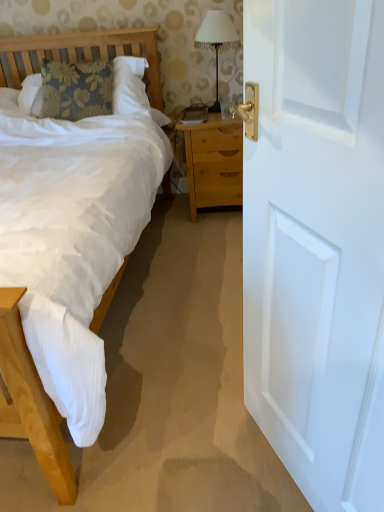
This screenshot has height=512, width=384. Describe the element at coordinates (216, 40) in the screenshot. I see `white fabric lampshade at upper center` at that location.

The height and width of the screenshot is (512, 384). In order to click on light brown wooden nightstand at center in this screenshot , I will do `click(213, 162)`.

Could you tell me if light brown wooden nightstand at center is facing white painted wood door at right?

Yes.

At what (x,y) coordinates should I click in order to perform the action: click on door above the light brown wooden nightstand at center (from a real-world perspective). Please return your answer as a coordinate pair (x, y). Looking at the image, I should click on (317, 244).

Does light brown wooden nightstand at center have a larger size compared to white painted wood door at right?

Correct, light brown wooden nightstand at center is larger in size than white painted wood door at right.

Are light brown wooden nightstand at center and white painted wood door at right located far from each other?

Absolutely, light brown wooden nightstand at center is distant from white painted wood door at right.

Who is smaller, white painted wood door at right or light brown wooden nightstand at center?

white painted wood door at right is smaller.

Looking at their sizes, would you say white painted wood door at right is wider or thinner than light brown wooden nightstand at center?

Clearly, white painted wood door at right has less width compared to light brown wooden nightstand at center.

Is white painted wood door at right to the left of light brown wooden nightstand at center from the viewer's perspective?

No.

Does white painted wood door at right have a greater height compared to light brown wooden nightstand at center?

Yes.

Considering the positions of points (209, 16) and (233, 132), is point (209, 16) farther from camera compared to point (233, 132)?

Yes, it is.

Is white fabric lampshade at upper center far away from light brown wooden nightstand at center?

That's not correct — white fabric lampshade at upper center is a little close to light brown wooden nightstand at center.

Is light brown wooden nightstand at center located within white fabric lampshade at upper center?

No, white fabric lampshade at upper center does not contain light brown wooden nightstand at center.

Can you confirm if white fabric lampshade at upper center is positioned to the left of light brown wooden nightstand at center?

In fact, white fabric lampshade at upper center is to the right of light brown wooden nightstand at center.

Which is behind, point (213, 20) or point (303, 200)?

The point (213, 20) is behind.

Based on their sizes in the image, would you say white fabric lampshade at upper center is bigger or smaller than white painted wood door at right?

white fabric lampshade at upper center is smaller than white painted wood door at right.

Does white fabric lampshade at upper center appear on the left side of white painted wood door at right?

Indeed, white fabric lampshade at upper center is positioned on the left side of white painted wood door at right.

Measure the distance between white fabric lampshade at upper center and white painted wood door at right.

The distance of white fabric lampshade at upper center from white painted wood door at right is 2.04 meters.

Is white painted wood door at right oriented away from white fabric lampshade at upper center?

No, white painted wood door at right is not facing the opposite direction of white fabric lampshade at upper center.

Which is closer, (332, 408) or (202, 32)?

Point (332, 408) appears to be closer to the viewer than point (202, 32).

Would you say white fabric lampshade at upper center is part of white painted wood door at right's contents?

No, white fabric lampshade at upper center is not surrounded by white painted wood door at right.

How many degrees apart are the facing directions of white painted wood door at right and white fabric lampshade at upper center?

They differ by 64.4 degrees in their facing directions.

Considering the relative positions of light brown wooden nightstand at center and white fabric lampshade at upper center in the image provided, is light brown wooden nightstand at center to the right of white fabric lampshade at upper center from the viewer's perspective?

In fact, light brown wooden nightstand at center is to the left of white fabric lampshade at upper center.

Looking at this image, does light brown wooden nightstand at center turn towards white fabric lampshade at upper center?

No, light brown wooden nightstand at center is not aimed at white fabric lampshade at upper center.

I want to click on bedside lamp above the light brown wooden nightstand at center (from a real-world perspective), so click(216, 40).

Image resolution: width=384 pixels, height=512 pixels. Identify the location of nightstand on the left of white painted wood door at right. (213, 162).

Image resolution: width=384 pixels, height=512 pixels. What are the coordinates of `door that appears below the light brown wooden nightstand at center (from the image's perspective)` in the screenshot? It's located at [317, 244].

Based on their spatial positions, is white painted wood door at right or white fabric lampshade at upper center closer to light brown wooden nightstand at center?

white fabric lampshade at upper center is positioned closer to the anchor light brown wooden nightstand at center.

Looking at the image, which one is located further to white fabric lampshade at upper center, white painted wood door at right or light brown wooden nightstand at center?

The object further to white fabric lampshade at upper center is white painted wood door at right.

Which object lies further to the anchor point white painted wood door at right, light brown wooden nightstand at center or white fabric lampshade at upper center?

Based on the image, white fabric lampshade at upper center appears to be further to white painted wood door at right.

From the image, which object appears to be farther from light brown wooden nightstand at center, white fabric lampshade at upper center or white painted wood door at right?

white painted wood door at right lies further to light brown wooden nightstand at center than the other object.

When comparing their distances from white fabric lampshade at upper center, does light brown wooden nightstand at center or white painted wood door at right seem further?

The object further to white fabric lampshade at upper center is white painted wood door at right.

Considering their positions, is white fabric lampshade at upper center positioned closer to white painted wood door at right than light brown wooden nightstand at center?

light brown wooden nightstand at center.

The image size is (384, 512). In order to click on bedside lamp between white painted wood door at right and light brown wooden nightstand at center in the front-back direction in this screenshot , I will do `click(216, 40)`.